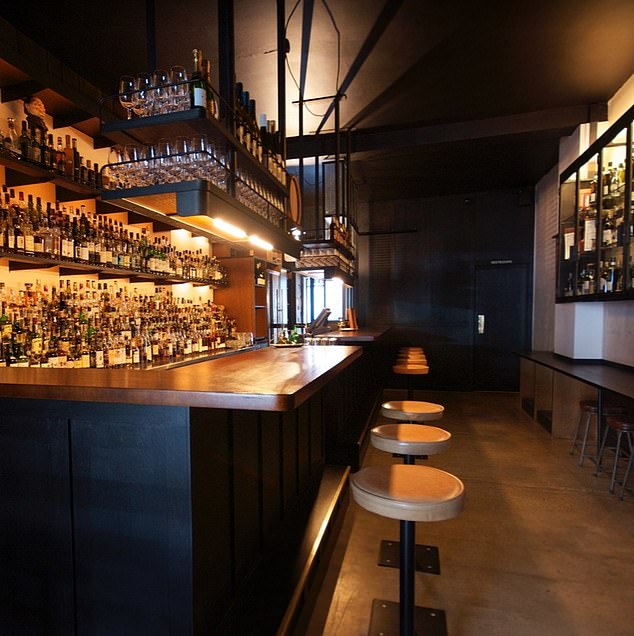
Locate an element on the screen. The image size is (634, 636). metal stools is located at coordinates (589, 413), (619, 430).